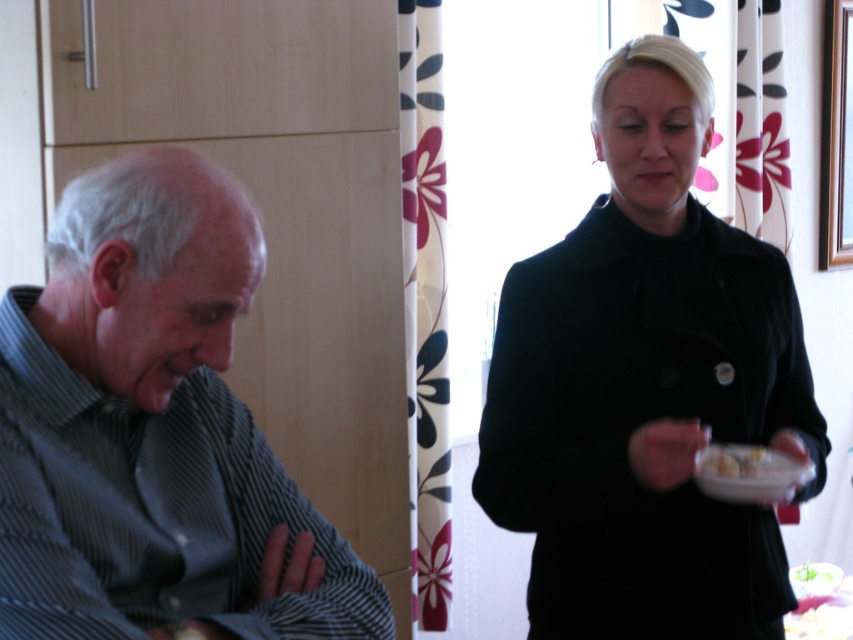
Does black matte coat at center appear on the left side of white glossy bowl at upper right?

Yes, black matte coat at center is to the left of white glossy bowl at upper right.

Is black matte coat at center thinner than white glossy bowl at upper right?

A: Incorrect, black matte coat at center's width is not less than white glossy bowl at upper right's.

Which is behind, point (729, 321) or point (756, 456)?

Positioned behind is point (729, 321).

You are a GUI agent. You are given a task and a screenshot of the screen. Output one action in this format:
    pyautogui.click(x=<x>, y=<y>)
    Task: Click on the black matte coat at center
    This screenshot has width=853, height=640.
    Given the screenshot: What is the action you would take?
    pyautogui.click(x=646, y=385)

Where is `striped shirt at left`? This screenshot has height=640, width=853. striped shirt at left is located at coordinates (154, 433).

Locate an element on the screen. The image size is (853, 640). striped shirt at left is located at coordinates (154, 433).

Which of these two, black matte coat at center or striped shirt at left, stands taller?

black matte coat at center is taller.

Who is more forward, (724,508) or (364,579)?

Point (364,579)

This screenshot has height=640, width=853. Identify the location of black matte coat at center. (646, 385).

Locate an element on the screen. The image size is (853, 640). black matte coat at center is located at coordinates (646, 385).